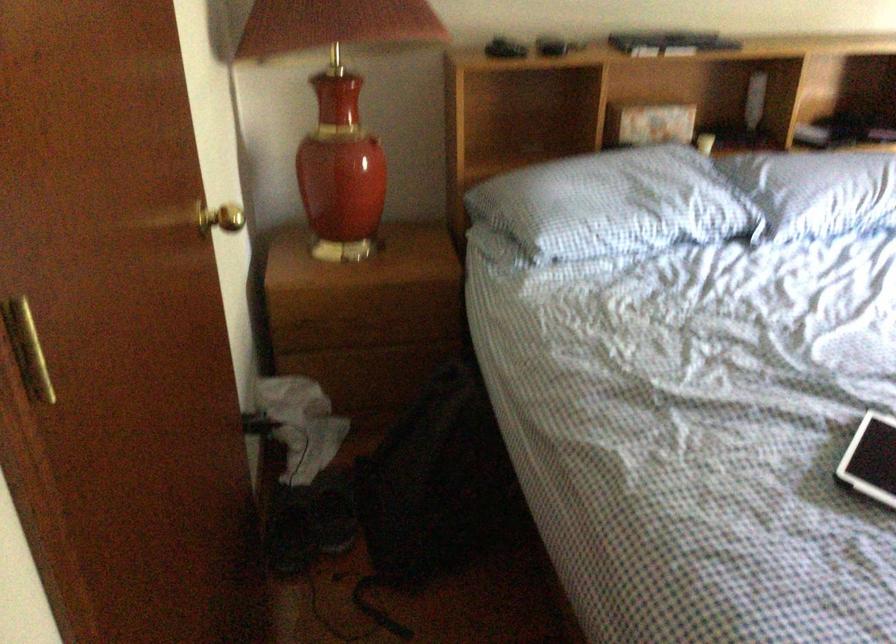
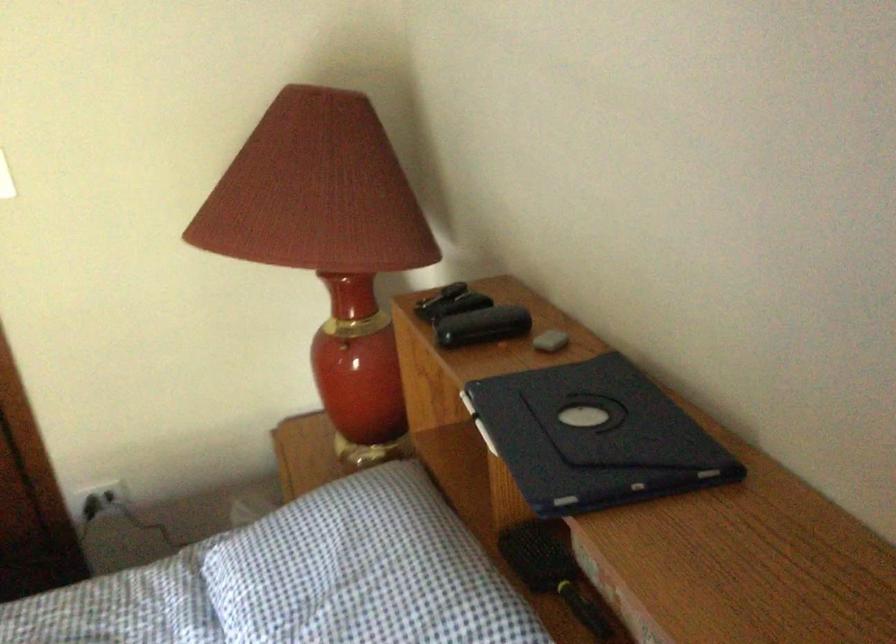
The point at (x=643, y=145) is marked in the first image. Where is the corresponding point in the second image?

(552, 571)